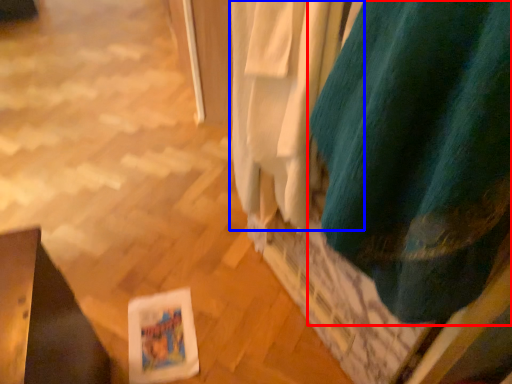
Question: Which object appears closest to the camera in this image, curtain (highlighted by a red box) or curtain (highlighted by a blue box)?

Choices:
 (A) curtain
 (B) curtain

Answer: (A)